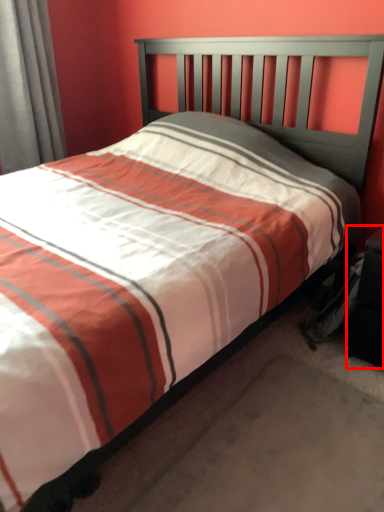
Question: Considering the relative positions of nightstand (annotated by the red box) and curtain in the image provided, where is nightstand (annotated by the red box) located with respect to the staircase?

Choices:
 (A) right
 (B) left

Answer: (A)